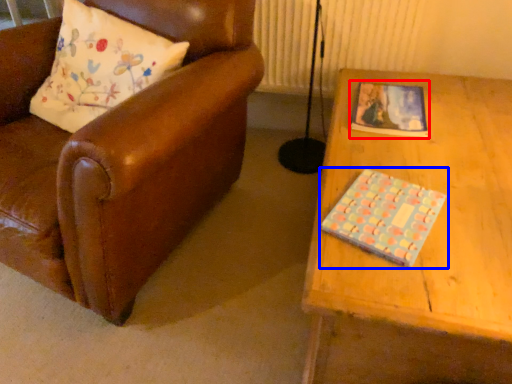
Question: Among these objects, which one is nearest to the camera, book (highlighted by a red box) or book (highlighted by a blue box)?

Choices:
 (A) book
 (B) book

Answer: (B)